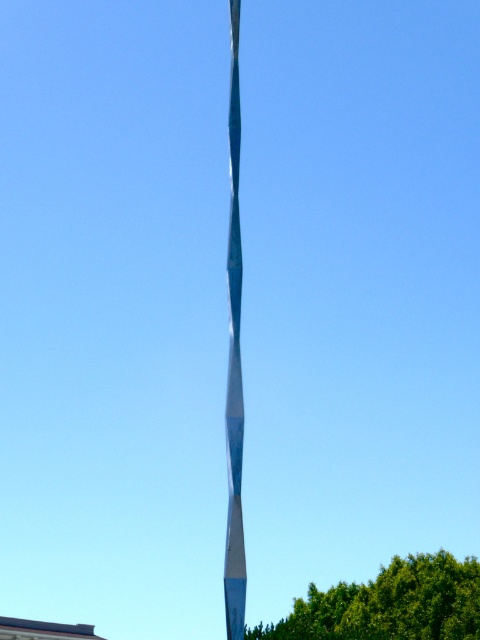
Looking at this image, you are standing in front of the sculpture and want to take a photo that includes both the green leafy tree at lower center and the shiny blue pole at center. Which object should you frame first to ensure both are visible in the photo?

The green leafy tree at lower center is bigger than the shiny blue pole at center, so you should frame the green leafy tree at lower center first to ensure both fit in the photo.

You are a photographer planning to capture the shiny blue pole at center and the green leafy tree at lower center in a single shot. Based on their heights, which object will appear taller in the photograph?

The shiny blue pole at center will appear taller in the photograph because the green leafy tree at lower center is not as tall as it.